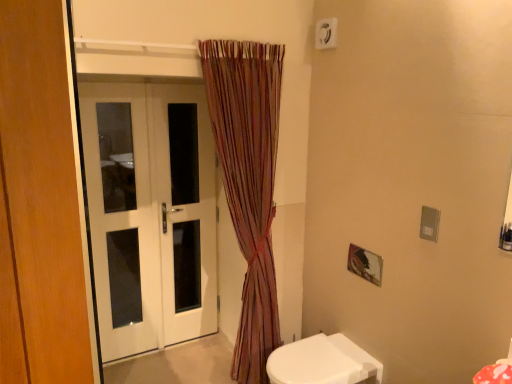
Question: Does white plastic electric outlet at upper center have a lesser width compared to white glossy toilet at lower right?

Choices:
 (A) yes
 (B) no

Answer: (A)

Question: Is white plastic electric outlet at upper center positioned behind white glossy toilet at lower right?

Choices:
 (A) yes
 (B) no

Answer: (A)

Question: From a real-world perspective, is white plastic electric outlet at upper center beneath white glossy toilet at lower right?

Choices:
 (A) no
 (B) yes

Answer: (A)

Question: Can you confirm if white plastic electric outlet at upper center is positioned to the right of white glossy toilet at lower right?

Choices:
 (A) yes
 (B) no

Answer: (A)

Question: Is the surface of white plastic electric outlet at upper center in direct contact with white glossy toilet at lower right?

Choices:
 (A) yes
 (B) no

Answer: (B)

Question: From the image's perspective, is white glossy toilet at lower right positioned above or below striped fabric curtain at center?

Choices:
 (A) below
 (B) above

Answer: (A)

Question: Is point (289, 382) closer or farther from the camera than point (233, 200)?

Choices:
 (A) closer
 (B) farther

Answer: (A)

Question: Based on their sizes in the image, would you say white glossy toilet at lower right is bigger or smaller than striped fabric curtain at center?

Choices:
 (A) big
 (B) small

Answer: (B)

Question: Is white glossy toilet at lower right wider or thinner than striped fabric curtain at center?

Choices:
 (A) thin
 (B) wide

Answer: (B)

Question: From the image's perspective, is white glossy door at left positioned above or below white plastic electric outlet at upper center?

Choices:
 (A) below
 (B) above

Answer: (A)

Question: Based on their positions, is white glossy door at left located to the left or right of white plastic electric outlet at upper center?

Choices:
 (A) left
 (B) right

Answer: (A)

Question: Considering their positions, is white glossy door at left located in front of or behind white plastic electric outlet at upper center?

Choices:
 (A) behind
 (B) front

Answer: (A)

Question: Considering the positions of white glossy door at left and white plastic electric outlet at upper center in the image, is white glossy door at left bigger or smaller than white plastic electric outlet at upper center?

Choices:
 (A) small
 (B) big

Answer: (B)

Question: In the image, is striped fabric curtain at center on the left side or the right side of white glossy toilet at lower right?

Choices:
 (A) right
 (B) left

Answer: (B)

Question: From a real-world perspective, relative to white glossy toilet at lower right, is striped fabric curtain at center vertically above or below?

Choices:
 (A) below
 (B) above

Answer: (B)